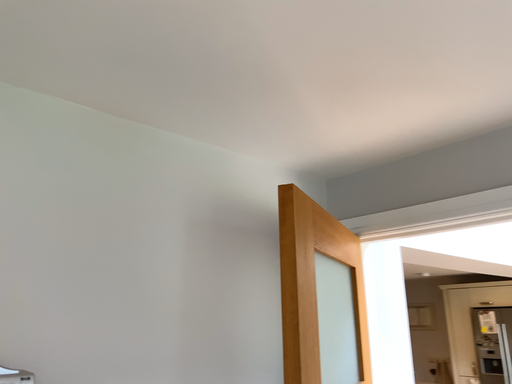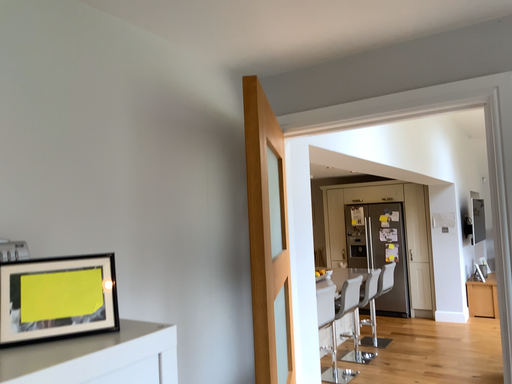
Question: Which way did the camera rotate in the video?

Choices:
 (A) rotated left
 (B) rotated right

Answer: (B)